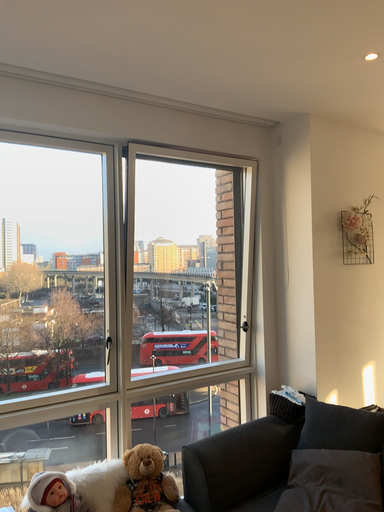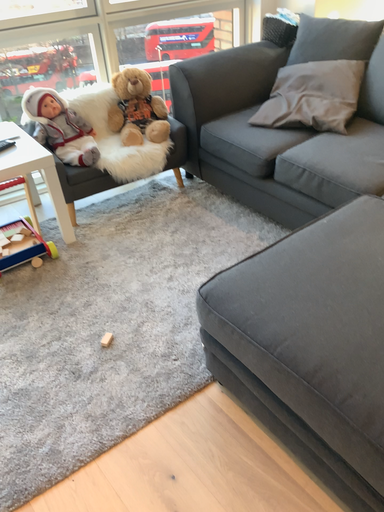
Question: Which way did the camera rotate in the video?

Choices:
 (A) rotated downward
 (B) rotated upward

Answer: (A)